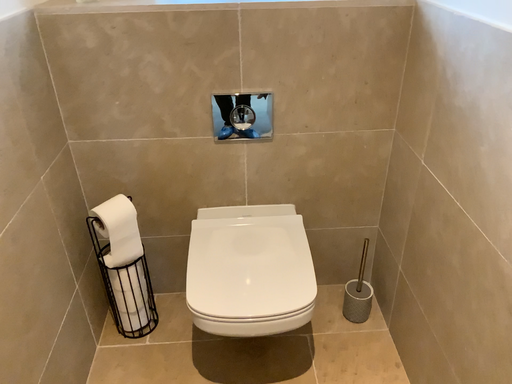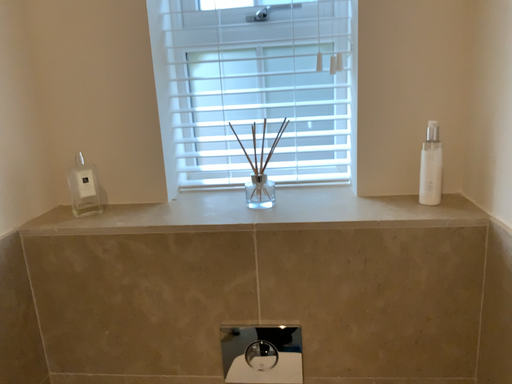
Question: Which way did the camera rotate in the video?

Choices:
 (A) rotated upward
 (B) rotated downward

Answer: (A)